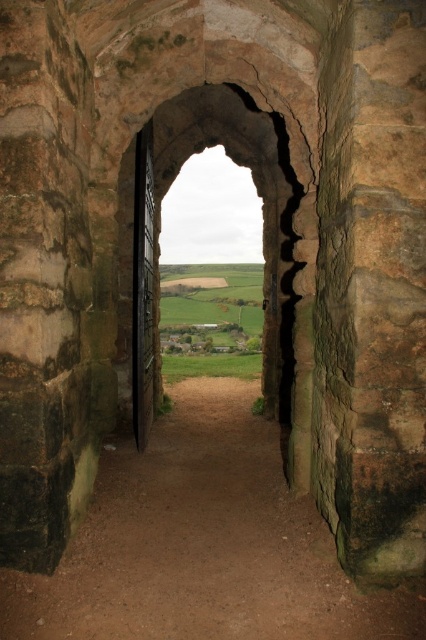
Question: Is brown dirt path at center to the right of rough stone archway at center from the viewer's perspective?

Choices:
 (A) yes
 (B) no

Answer: (B)

Question: Which point is closer to the camera?

Choices:
 (A) (279, 401)
 (B) (198, 566)

Answer: (B)

Question: Among these points, which one is nearest to the camera?

Choices:
 (A) (86, 534)
 (B) (291, 307)

Answer: (A)

Question: Does brown dirt path at center have a greater width compared to rough stone archway at center?

Choices:
 (A) yes
 (B) no

Answer: (A)

Question: Where is brown dirt path at center located in relation to rough stone archway at center in the image?

Choices:
 (A) right
 (B) left

Answer: (B)